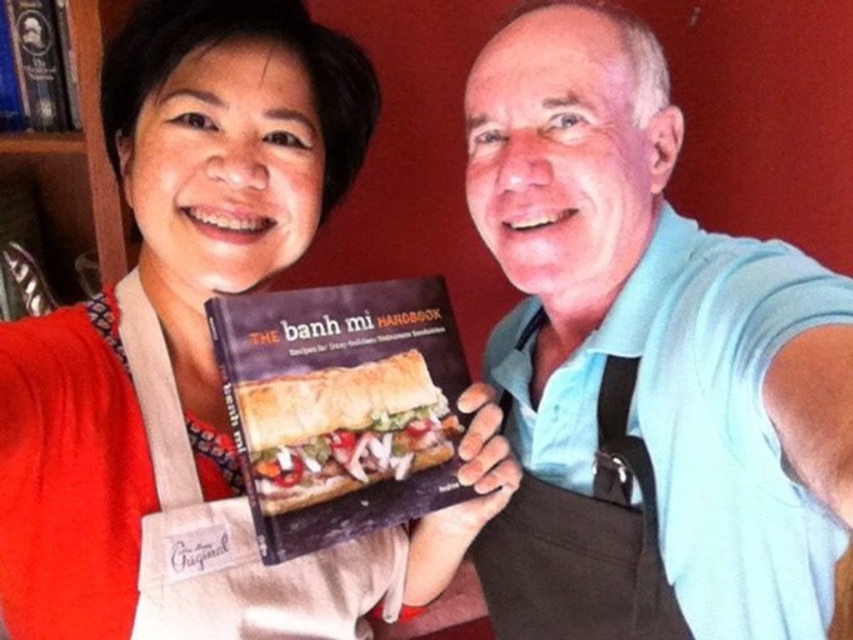
Question: Estimate the real-world distances between objects in this image. Which object is closer to the blue cotton shirt at center?

Choices:
 (A) matte black book at center
 (B) brown fabric apron at center
 (C) golden brown bread at center
 (D) wooden bookshelf at upper left

Answer: (B)

Question: Can you confirm if golden brown bread at center is positioned above brown fabric apron at center?

Choices:
 (A) yes
 (B) no

Answer: (A)

Question: Is blue cotton shirt at center below hardcover book at upper left?

Choices:
 (A) yes
 (B) no

Answer: (A)

Question: Does matte apron at center have a greater width compared to hardcover book at upper left?

Choices:
 (A) no
 (B) yes

Answer: (B)

Question: Among these points, which one is nearest to the camera?

Choices:
 (A) (772, 484)
 (B) (283, 552)

Answer: (B)

Question: Which of the following is the closest to the observer?

Choices:
 (A) (834, 579)
 (B) (173, 113)
 (C) (648, 547)

Answer: (B)